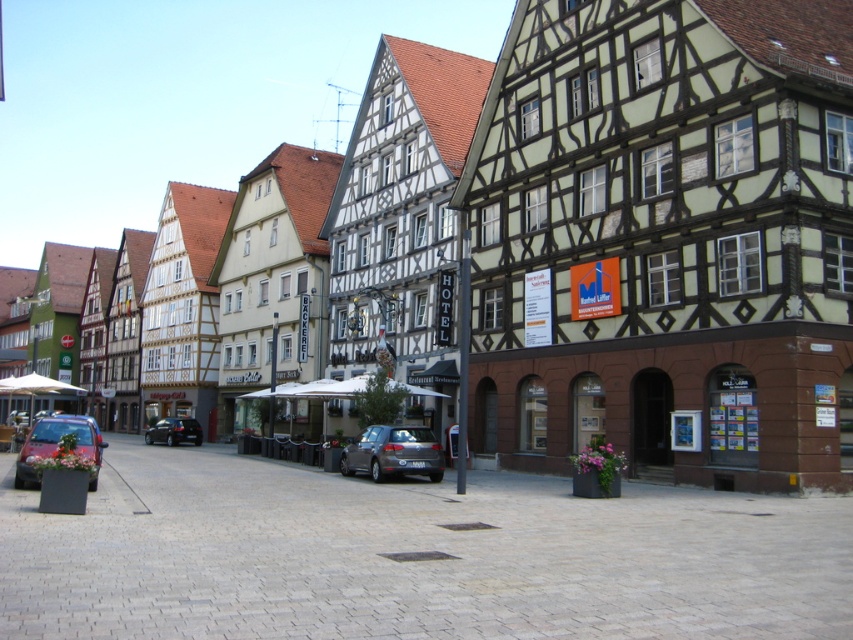
You are a delivery driver who needs to park your vehicle in this historic town square. Your truck is 2 meters wide. The satin silver metallic car at center and the matte red car at lower left are already parked. Which car, if any, would block your truck from parking between them due to insufficient space?

The satin silver metallic car at center has a lesser width compared to the matte red car at lower left. Since your truck is 2 meters wide, the space between the two cars may be too narrow if the combined width of the cars plus any additional spacing is less than 2 meters. However, without exact measurements of the distance between them, it is uncertain which car specifically would block the truck. The answer requires knowing the total available space between both cars, not just their widths.

Looking at this image, you are standing at the point labeled point (13, 483) and want to walk to the point labeled point (160, 429). Which direction should you face to walk directly towards your destination?

You should face away from the camera because point (13, 483) is closer to the camera than point (160, 429).

You are a tourist standing at the entrance of the historic town square. You see a matte red car at lower left and a shiny black sedan at center. Which car is closer to your right side?

The shiny black sedan at center is closer to your right side because the matte red car at lower left is positioned to the left of it.